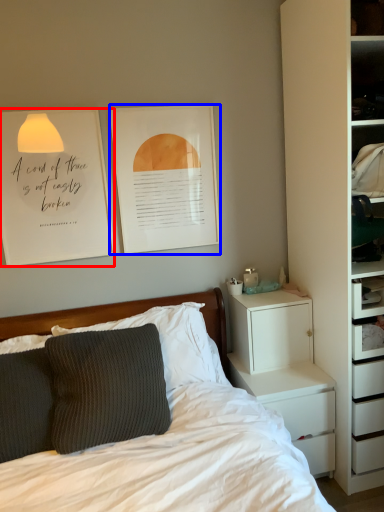
Question: Which object appears closest to the camera in this image, bulletin board (highlighted by a red box) or picture frame (highlighted by a blue box)?

Choices:
 (A) bulletin board
 (B) picture frame

Answer: (A)